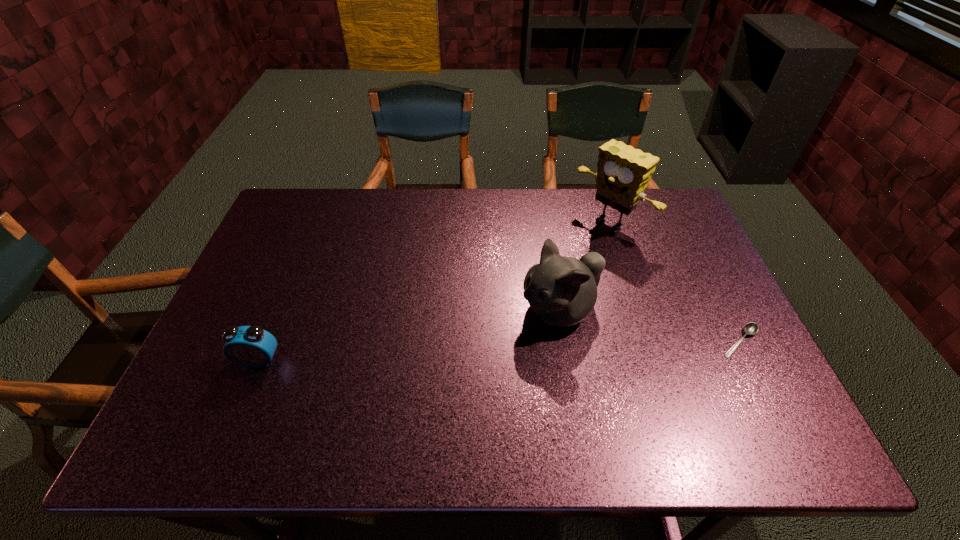
You are a GUI agent. You are given a task and a screenshot of the screen. Output one action in this format:
    pyautogui.click(x=<x>, y=<y>)
    Task: Click on the vacant space at the far edge of the desktop
    
    Given the screenshot: What is the action you would take?
    pyautogui.click(x=539, y=232)

This screenshot has width=960, height=540. In the image, there is a desktop. Find the location of `free space at the near edge`. free space at the near edge is located at coordinates (314, 400).

This screenshot has width=960, height=540. I want to click on vacant area at the left edge, so (267, 252).

Locate an element on the screen. Image resolution: width=960 pixels, height=540 pixels. vacant area at the right edge is located at coordinates (687, 287).

This screenshot has width=960, height=540. In the image, there is a desktop. In order to click on blank space at the far left corner in this screenshot , I will do `click(291, 198)`.

Where is `vacant space at the near left corner`? The image size is (960, 540). vacant space at the near left corner is located at coordinates (204, 374).

Identify the location of vacant area that lies between the shortest object and the alarm clock. The image size is (960, 540). (499, 351).

The width and height of the screenshot is (960, 540). Identify the location of free space between the leftmost object and the hamster. (409, 335).

The width and height of the screenshot is (960, 540). Identify the location of vacant point located between the farthest object and the leftmost object. (435, 292).

I want to click on free spot between the second tallest object and the soupspoon, so click(650, 326).